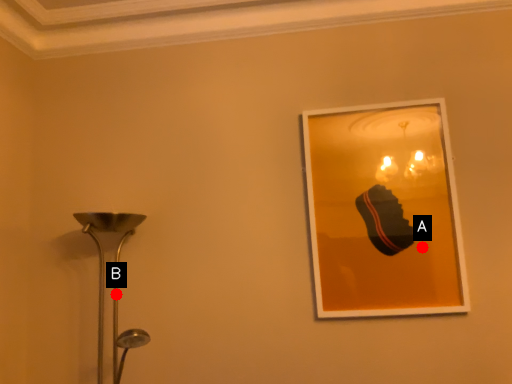
Question: Two points are circled on the image, labeled by A and B beside each circle. Which point is closer to the camera taking this photo?

Choices:
 (A) A is closer
 (B) B is closer

Answer: (A)